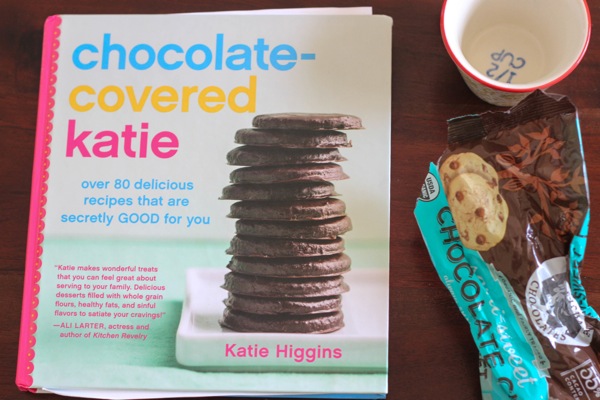
Identify the location of table. The image size is (600, 400). (431, 363).